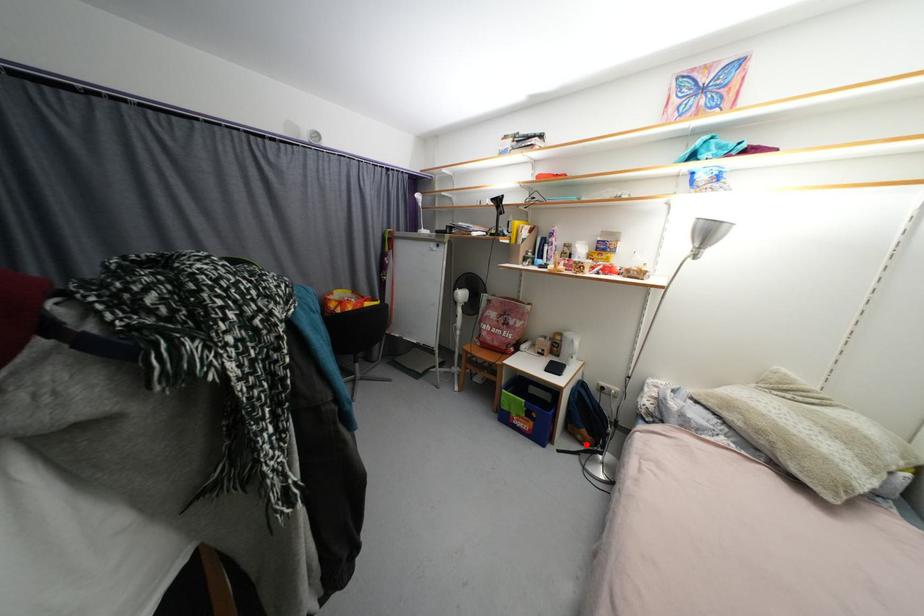
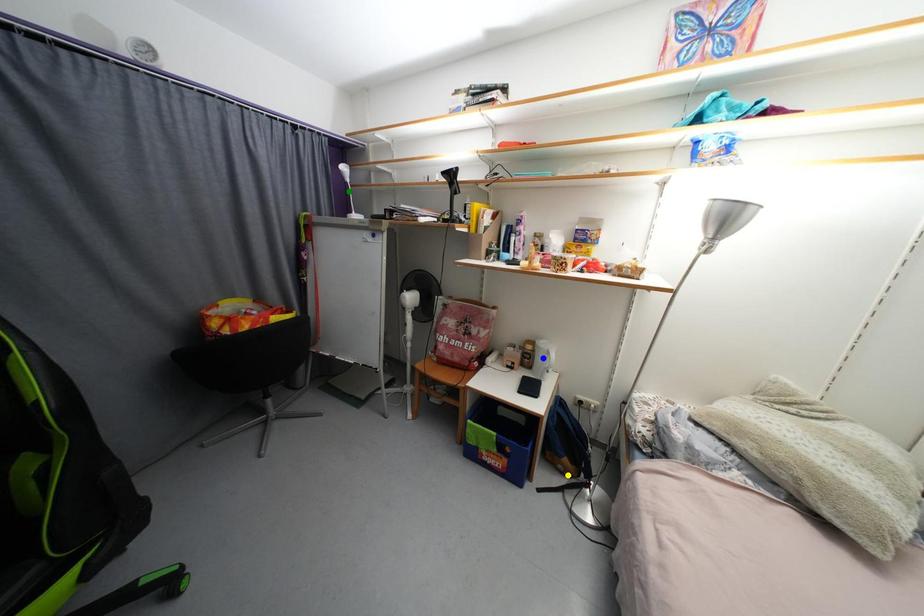
Question: I am providing you with two images of the same scene from different viewpoints. A red point is marked on the first image. You are given multiple points on the second image. In image 2, which mark is for the same physical point as the one in image 1?

Choices:
 (A) blue point
 (B) yellow point
 (C) green point

Answer: (B)